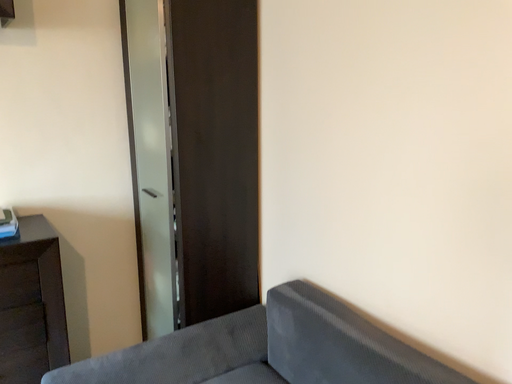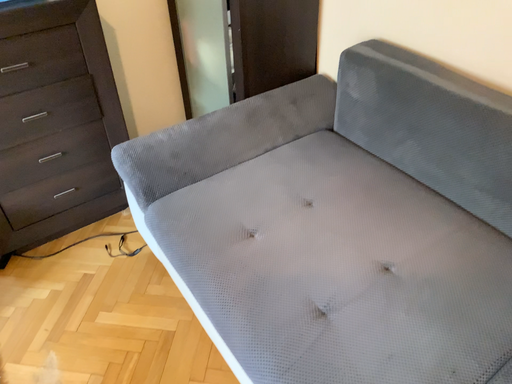
Question: Which way did the camera rotate in the video?

Choices:
 (A) rotated downward
 (B) rotated upward

Answer: (A)